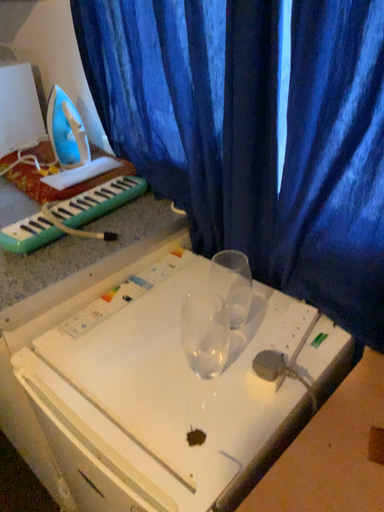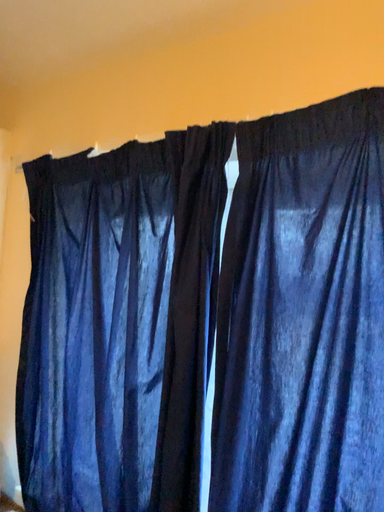
Question: Which way did the camera rotate in the video?

Choices:
 (A) rotated right
 (B) rotated left

Answer: (A)